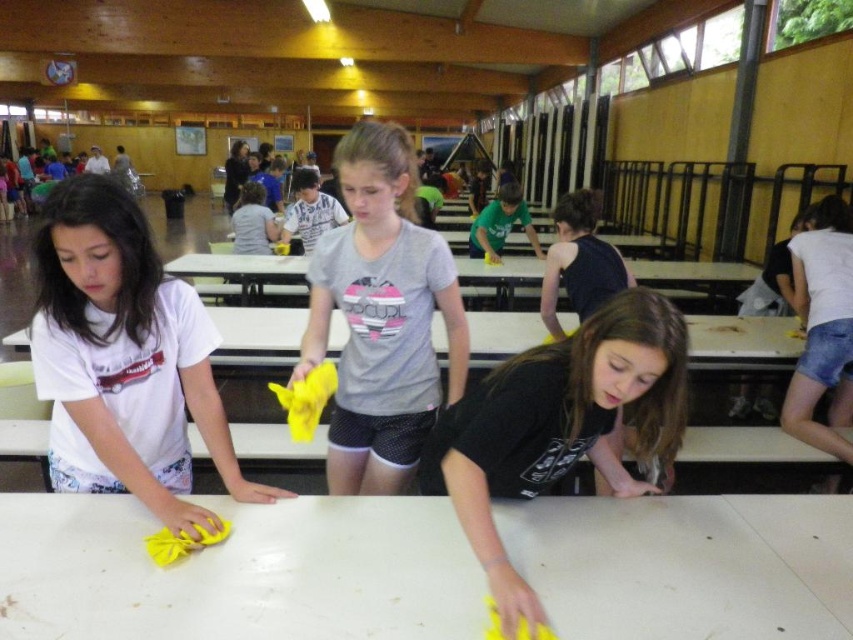
Is white printed t-shirt at left behind black matte shirt at lower center?

Yes, white printed t-shirt at left is behind black matte shirt at lower center.

The height and width of the screenshot is (640, 853). What do you see at coordinates (125, 358) in the screenshot?
I see `white printed t-shirt at left` at bounding box center [125, 358].

This screenshot has width=853, height=640. I want to click on white printed t-shirt at left, so click(x=125, y=358).

Who is shorter, white printed t-shirt at left or gray matte t-shirt at center?

Standing shorter between the two is white printed t-shirt at left.

Between white printed t-shirt at left and gray matte t-shirt at center, which one is positioned higher?

gray matte t-shirt at center is above.

Which is behind, point (73, 220) or point (352, 196)?

The point (352, 196) is more distant.

I want to click on white printed t-shirt at left, so click(125, 358).

Who is shorter, black matte shirt at lower center or dark blue jersey at center?

black matte shirt at lower center

Which is more to the right, black matte shirt at lower center or dark blue jersey at center?

dark blue jersey at center

Identify the location of black matte shirt at lower center. (560, 426).

Where is `black matte shirt at lower center`? This screenshot has width=853, height=640. black matte shirt at lower center is located at coordinates (560, 426).